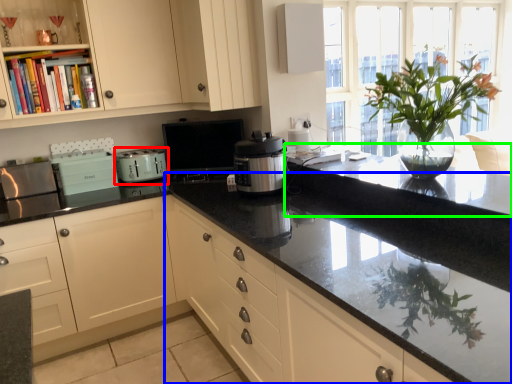
Question: Considering the real-world distances, which object is closest to kitchen appliance (highlighted by a red box)? countertop (highlighted by a blue box) or countertop (highlighted by a green box).

Choices:
 (A) countertop
 (B) countertop

Answer: (A)